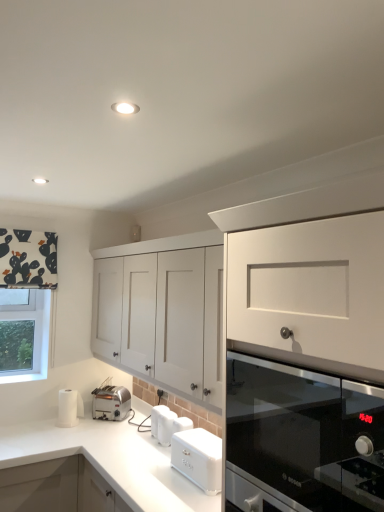
Question: Is the depth of white matte bread bin at lower center, the first kitchen appliance when ordered from right to left, less than that of black glass oven at right?

Choices:
 (A) yes
 (B) no

Answer: (B)

Question: Is white matte bread bin at lower center, which is counted as the 1th kitchen appliance, starting from the front, at the left side of black glass oven at right?

Choices:
 (A) no
 (B) yes

Answer: (B)

Question: Is white matte bread bin at lower center, the first kitchen appliance when ordered from right to left, surrounding black glass oven at right?

Choices:
 (A) yes
 (B) no

Answer: (B)

Question: Is white matte bread bin at lower center, the first kitchen appliance when ordered from right to left, behind black glass oven at right?

Choices:
 (A) yes
 (B) no

Answer: (A)

Question: From a real-world perspective, is white matte bread bin at lower center, the 2th kitchen appliance positioned from the back, on top of black glass oven at right?

Choices:
 (A) yes
 (B) no

Answer: (B)

Question: From a real-world perspective, is black printed fabric at upper left above or below silver metallic toaster at lower left, placed as the second kitchen appliance when sorted from front to back?

Choices:
 (A) below
 (B) above

Answer: (B)

Question: In terms of width, does black printed fabric at upper left look wider or thinner when compared to silver metallic toaster at lower left, which is the first kitchen appliance from left to right?

Choices:
 (A) thin
 (B) wide

Answer: (A)

Question: Does point (3, 269) appear closer or farther from the camera than point (125, 403)?

Choices:
 (A) closer
 (B) farther

Answer: (A)

Question: Is black printed fabric at upper left in front of or behind silver metallic toaster at lower left, which is counted as the second kitchen appliance, starting from the right, in the image?

Choices:
 (A) front
 (B) behind

Answer: (A)

Question: Is silver metallic toaster at lower left, arranged as the first kitchen appliance when viewed from the back, wider or thinner than black glass oven at right?

Choices:
 (A) thin
 (B) wide

Answer: (A)

Question: Is silver metallic toaster at lower left, placed as the second kitchen appliance when sorted from front to back, inside or outside of black glass oven at right?

Choices:
 (A) outside
 (B) inside

Answer: (A)

Question: Considering the positions of silver metallic toaster at lower left, which is the first kitchen appliance from left to right, and black glass oven at right in the image, is silver metallic toaster at lower left, which is the first kitchen appliance from left to right, taller or shorter than black glass oven at right?

Choices:
 (A) tall
 (B) short

Answer: (B)

Question: From a real-world perspective, is silver metallic toaster at lower left, placed as the second kitchen appliance when sorted from front to back, physically located above or below black glass oven at right?

Choices:
 (A) above
 (B) below

Answer: (B)

Question: From the image's perspective, relative to white matte cabinet at center, is white plastic toaster at lower center above or below?

Choices:
 (A) above
 (B) below

Answer: (B)

Question: Is white plastic toaster at lower center inside or outside of white matte cabinet at center?

Choices:
 (A) outside
 (B) inside

Answer: (A)